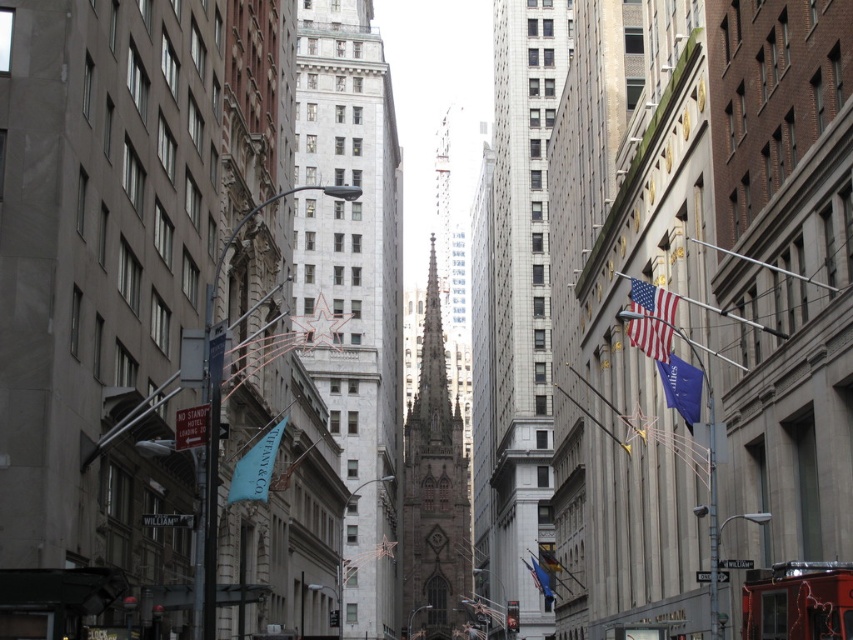
Question: Which object is positioned farthest from the brown stone tower at center?

Choices:
 (A) blue fabric flag at lower left
 (B) blue fabric flag at right

Answer: (B)

Question: Can you confirm if gray stone tower at center is positioned below white tiled tower at center?

Choices:
 (A) yes
 (B) no

Answer: (A)

Question: Can you confirm if gray stone tower at center is positioned to the left of blue fabric flag at right?

Choices:
 (A) no
 (B) yes

Answer: (B)

Question: Can you confirm if blue fabric flag at lower left is bigger than blue fabric flag at lower center?

Choices:
 (A) no
 (B) yes

Answer: (B)

Question: Which is farther from the gray stone tower at center?

Choices:
 (A) brown stone tower at center
 (B) blue fabric flag at lower center
 (C) blue fabric flag at lower left
 (D) blue fabric flag at right

Answer: (D)

Question: Which object is closer to the camera taking this photo?

Choices:
 (A) gray stone tower at center
 (B) brown stone tower at center
 (C) blue fabric flag at lower center
 (D) american flag at center

Answer: (D)